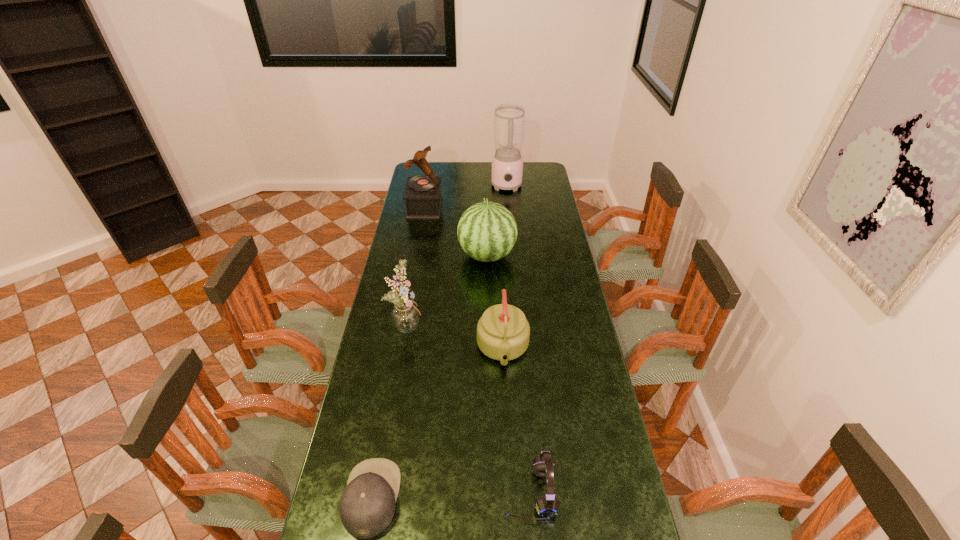
Where is `vacant space situated on the back of the third farthest object`? vacant space situated on the back of the third farthest object is located at coordinates (487, 228).

The image size is (960, 540). What are the coordinates of `free space located 0.170m at the spout of the kettle` in the screenshot? It's located at (507, 424).

Where is `blank area located on the ear cushions of the headset`? This screenshot has width=960, height=540. blank area located on the ear cushions of the headset is located at coordinates (393, 492).

The image size is (960, 540). Identify the location of vacant region located on the ear cushions of the headset. (437, 492).

The width and height of the screenshot is (960, 540). In order to click on free space located 0.080m on the ear cushions of the headset in this screenshot , I will do `click(473, 492)`.

Identify the location of object positioned at the far edge. (509, 118).

Where is `phonograph_record that is at the left edge`? Image resolution: width=960 pixels, height=540 pixels. phonograph_record that is at the left edge is located at coordinates (422, 195).

Find the location of a particular element. bouquet that is at the left edge is located at coordinates (405, 316).

Find the location of a particular element. The width and height of the screenshot is (960, 540). free space at the far edge is located at coordinates (465, 166).

I want to click on blank area at the left edge, so click(371, 354).